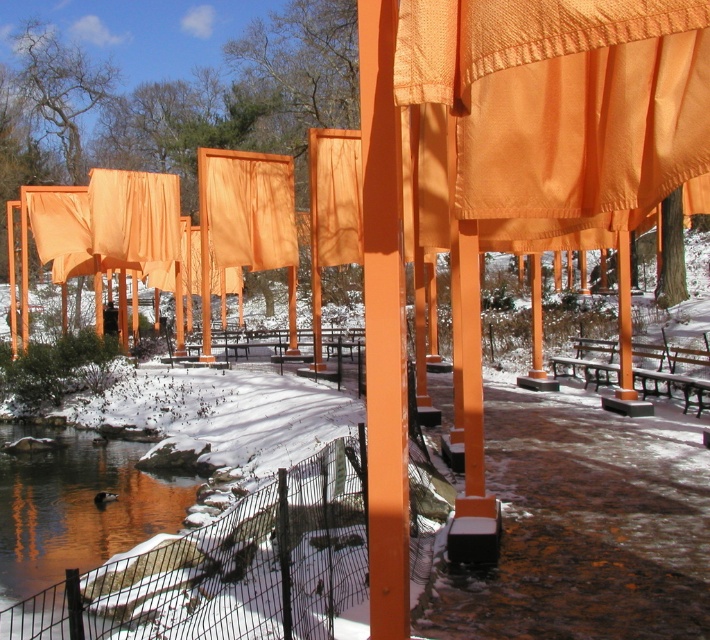
Question: Which object is closer to the camera taking this photo?

Choices:
 (A) orange fabric curtain at center
 (B) orange satin curtain at center

Answer: (B)

Question: Where is orange satin curtain at center located in relation to orange fabric curtain at center in the image?

Choices:
 (A) above
 (B) below

Answer: (B)

Question: Which point appears closest to the camera in this image?

Choices:
 (A) (400, 93)
 (B) (82, 564)

Answer: (A)

Question: Does orange satin curtain at center have a greater width compared to smooth water at lower left?

Choices:
 (A) no
 (B) yes

Answer: (A)

Question: Considering the relative positions of orange satin curtain at center and orange fabric curtain at center in the image provided, where is orange satin curtain at center located with respect to orange fabric curtain at center?

Choices:
 (A) above
 (B) below

Answer: (B)

Question: Which is farther from the orange satin curtain at center?

Choices:
 (A) smooth water at lower left
 (B) orange fabric curtain at center

Answer: (B)